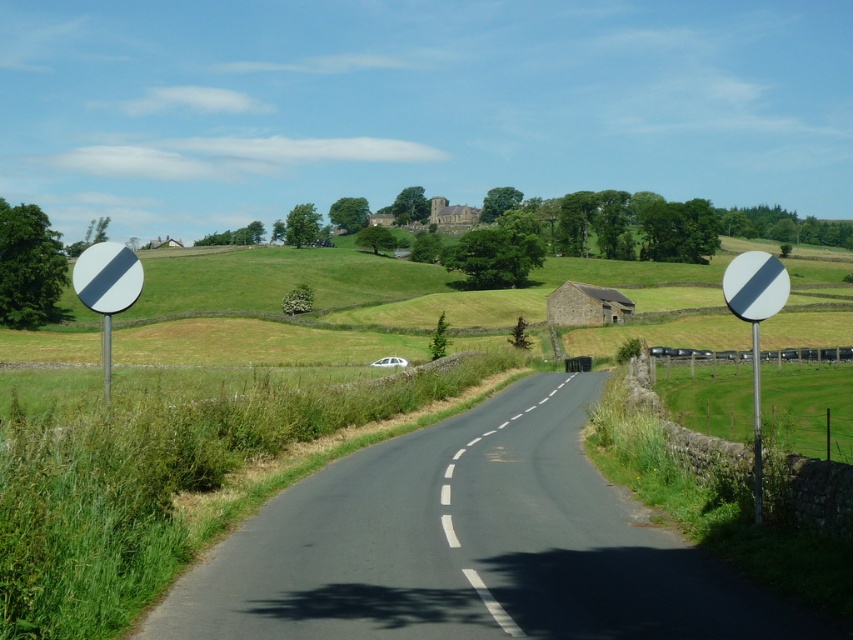
Is white glossy circle at right positioned before white reflective circle at right?

Yes, it is in front of white reflective circle at right.

Can you confirm if white glossy circle at right is taller than white reflective circle at right?

Correct, white glossy circle at right is much taller as white reflective circle at right.

Is point (747, 296) positioned before point (730, 291)?

Yes.

Locate an element on the screen. white glossy circle at right is located at coordinates (755, 326).

Which is in front, point (107, 259) or point (751, 278)?

Point (751, 278) is in front.

Can you confirm if white glossy circle at left is positioned above white reflective circle at right?

No.

Identify the location of white glossy circle at left. (107, 288).

Does white reflective triangle at left have a greater height compared to white reflective circle at right?

Correct, white reflective triangle at left is much taller as white reflective circle at right.

Between point (91, 260) and point (762, 285), which one is positioned behind?

Positioned behind is point (91, 260).

Locate an element on the screen. white reflective triangle at left is located at coordinates (107, 276).